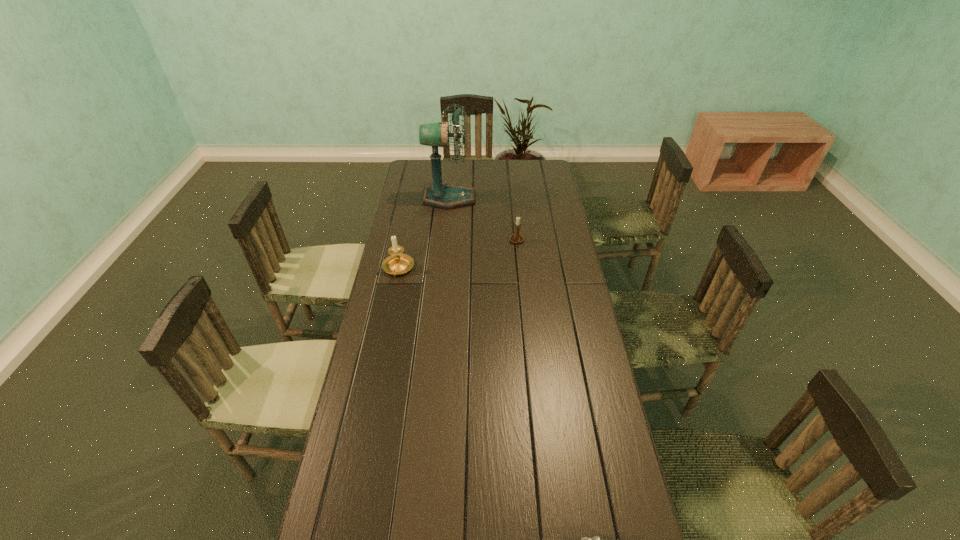
Identify which object is the third closest to the fan. Please provide its 2D coordinates. Your answer should be formatted as a tuple, i.e. [(x, y)], where the tuple contains the x and y coordinates of a point satisfying the conditions above.

[(596, 539)]

Where is `object that ranks as the closest to the farthest object`? object that ranks as the closest to the farthest object is located at coordinates (515, 238).

This screenshot has height=540, width=960. In order to click on vacant point that satisfies the following two spatial constraints: 1. in front of the farthest object where the wind blows; 2. with a handle on the side of the left candle holder in this screenshot , I will do `click(443, 269)`.